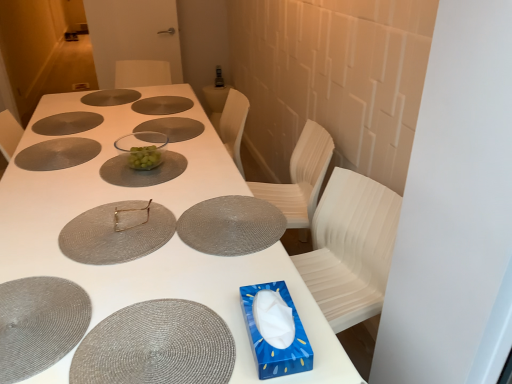
The width and height of the screenshot is (512, 384). What do you see at coordinates (39, 324) in the screenshot? I see `woven gray placemat at lower left` at bounding box center [39, 324].

I want to click on matte gray placemat at center, placed as the seventh glass plate when sorted from back to front, so click(x=231, y=225).

Find the location of a particular element. The height and width of the screenshot is (384, 512). matte gray glass plate at upper left, which is counted as the 7th glass plate, starting from the front is located at coordinates (67, 123).

Where is `matte gray glass plate at upper left, which is the 5th glass plate in back-to-front order`? The height and width of the screenshot is (384, 512). matte gray glass plate at upper left, which is the 5th glass plate in back-to-front order is located at coordinates (57, 154).

This screenshot has height=384, width=512. I want to click on transparent glass bowl at center, acting as the sixth glass plate starting from the back, so click(x=143, y=171).

In order to face transparent glass bowl at center, acting as the sixth glass plate starting from the back, should I rotate leftwards or rightwards?

To face it directly, rotate left by 14.122 degrees.

What are the coordinates of `woven gray placemat at lower left` in the screenshot? It's located at (39, 324).

Is there a large distance between matte gray glass plate at upper left, which is counted as the 7th glass plate, starting from the front, and woven gray placemat at lower left?

matte gray glass plate at upper left, which is counted as the 7th glass plate, starting from the front, is positioned a significant distance from woven gray placemat at lower left.

There is a woven gray placemat at lower left. Identify the location of glass plate above it (from a real-world perspective). (67, 123).

In the scene shown: How different are the orientations of matte gray glass plate at upper left, the third glass plate in the back-to-front sequence, and woven gray placemat at lower left in degrees?

matte gray glass plate at upper left, the third glass plate in the back-to-front sequence, and woven gray placemat at lower left are facing 0.347 degrees away from each other.

Can you confirm if matte gray glass plate at upper left, which is counted as the 7th glass plate, starting from the front, is bigger than woven gray placemat at lower left?

Correct, matte gray glass plate at upper left, which is counted as the 7th glass plate, starting from the front, is larger in size than woven gray placemat at lower left.

Where is `the 6th glass plate to the left of the blue paper tissue box at lower right, starting your count from the anchor`? Image resolution: width=512 pixels, height=384 pixels. the 6th glass plate to the left of the blue paper tissue box at lower right, starting your count from the anchor is located at coordinates (162, 105).

Looking at this image, from a real-world perspective, is blue paper tissue box at lower right on top of matte gray glass plate at center, which is the 2th glass plate in back-to-front order?

Indeed, from a real-world perspective, blue paper tissue box at lower right stands above matte gray glass plate at center, which is the 2th glass plate in back-to-front order.

Based on the photo, can you tell me how much blue paper tissue box at lower right and matte gray glass plate at center, which is the 2th glass plate in back-to-front order, differ in facing direction?

179 degrees separate the facing orientations of blue paper tissue box at lower right and matte gray glass plate at center, which is the 2th glass plate in back-to-front order.

Is blue paper tissue box at lower right behind matte gray glass plate at center, which is the 2th glass plate in back-to-front order?

No, it is in front of matte gray glass plate at center, which is the 2th glass plate in back-to-front order.

Are transparent glass bowl at center, acting as the sixth glass plate starting from the back, and matte gray placemat at center, arranged as the second glass plate when viewed from the front, far apart?

They are positioned close to each other.

Is transparent glass bowl at center, acting as the sixth glass plate starting from the back, facing towards matte gray placemat at center, arranged as the second glass plate when viewed from the front?

No, transparent glass bowl at center, acting as the sixth glass plate starting from the back, is not aimed at matte gray placemat at center, arranged as the second glass plate when viewed from the front.

Is transparent glass bowl at center, which is the fourth glass plate from front to back, taller or shorter than matte gray placemat at center, arranged as the second glass plate when viewed from the front?

Clearly, transparent glass bowl at center, which is the fourth glass plate from front to back, is taller compared to matte gray placemat at center, arranged as the second glass plate when viewed from the front.

From a real-world perspective, is transparent glass bowl at center, acting as the sixth glass plate starting from the back, located higher than matte gray placemat at center, arranged as the second glass plate when viewed from the front?

No, from a real-world perspective, transparent glass bowl at center, acting as the sixth glass plate starting from the back, is not on top of matte gray placemat at center, arranged as the second glass plate when viewed from the front.

Who is taller, matte silver fork at center or matte gray placemat at center, the 8th glass plate positioned from the back?

With more height is matte silver fork at center.

Where is `tableware above the matte gray placemat at center, arranged as the second glass plate when viewed from the front (from the image's perspective)`? Image resolution: width=512 pixels, height=384 pixels. tableware above the matte gray placemat at center, arranged as the second glass plate when viewed from the front (from the image's perspective) is located at coordinates (130, 211).

Is matte silver fork at center not near matte gray placemat at center, the 8th glass plate positioned from the back?

matte silver fork at center is actually quite close to matte gray placemat at center, the 8th glass plate positioned from the back.

Does matte silver fork at center have a smaller size compared to matte gray placemat at center, the 8th glass plate positioned from the back?

Correct, matte silver fork at center occupies less space than matte gray placemat at center, the 8th glass plate positioned from the back.

From the image's perspective, is matte gray placemat at center, the 8th glass plate positioned from the back, below transparent glass bowl at center, acting as the 6th glass plate starting from the front?

Indeed, from the image's perspective, matte gray placemat at center, the 8th glass plate positioned from the back, is shown beneath transparent glass bowl at center, acting as the 6th glass plate starting from the front.

Is the position of matte gray placemat at center, arranged as the second glass plate when viewed from the front, less distant than that of transparent glass bowl at center, acting as the 6th glass plate starting from the front?

Yes, the depth of matte gray placemat at center, arranged as the second glass plate when viewed from the front, is less than that of transparent glass bowl at center, acting as the 6th glass plate starting from the front.

Between point (101, 242) and point (173, 124), which one is positioned behind?

Positioned behind is point (173, 124).

Considering the relative positions of transparent glass bowl at center, acting as the sixth glass plate starting from the back, and matte gray placemat at center, placed as the third glass plate when sorted from front to back, in the image provided, is transparent glass bowl at center, acting as the sixth glass plate starting from the back, to the right of matte gray placemat at center, placed as the third glass plate when sorted from front to back, from the viewer's perspective?

In fact, transparent glass bowl at center, acting as the sixth glass plate starting from the back, is to the left of matte gray placemat at center, placed as the third glass plate when sorted from front to back.

From a real-world perspective, who is located lower, transparent glass bowl at center, which is the fourth glass plate from front to back, or matte gray placemat at center, placed as the seventh glass plate when sorted from back to front?

In real-world perspective, matte gray placemat at center, placed as the seventh glass plate when sorted from back to front, is lower.

Is transparent glass bowl at center, acting as the sixth glass plate starting from the back, positioned beyond the bounds of matte gray placemat at center, placed as the third glass plate when sorted from front to back?

Absolutely, transparent glass bowl at center, acting as the sixth glass plate starting from the back, is external to matte gray placemat at center, placed as the third glass plate when sorted from front to back.

Is matte gray placemat at center, the 8th glass plate positioned from the back, facing away from matte gray glass plate at center, the eighth glass plate viewed from the front?

No, matte gray glass plate at center, the eighth glass plate viewed from the front, is not at the back of matte gray placemat at center, the 8th glass plate positioned from the back.

From the image's perspective, which one is positioned higher, matte gray placemat at center, arranged as the second glass plate when viewed from the front, or matte gray glass plate at center, the eighth glass plate viewed from the front?

matte gray glass plate at center, the eighth glass plate viewed from the front.

Locate an element on the screen. The width and height of the screenshot is (512, 384). the 6th glass plate below when counting from the matte gray glass plate at center, which is the 2th glass plate in back-to-front order (from the image's perspective) is located at coordinates (117, 232).

Does matte gray placemat at center, arranged as the second glass plate when viewed from the front, lie in front of matte gray glass plate at center, the eighth glass plate viewed from the front?

Yes, it is.

In the image, there is a matte gray glass plate at upper left, the third glass plate in the back-to-front sequence. At what (x,y) coordinates should I click in order to perform the action: click on plate below it (from a real-world perspective). Please return your answer as a coordinate pair (x, y). Looking at the image, I should click on (39, 324).

From the image's perspective, count 7th glass plates upward from the blue paper tissue box at lower right and point to it. Please provide its 2D coordinates.

[(162, 105)]

Estimate the real-world distances between objects in this image. Which object is closer to matte silver fork at center, woven gray placemat at lower left or transparent glass bowl at center, which is the fourth glass plate from front to back?

transparent glass bowl at center, which is the fourth glass plate from front to back, lies closer to matte silver fork at center than the other object.

Looking at the image, which one is located further to matte gray placemat at center, the 8th glass plate positioned from the back, matte gray placemat at lower center, the first glass plate in the front-to-back sequence, or blue paper tissue box at lower right?

The object further to matte gray placemat at center, the 8th glass plate positioned from the back, is blue paper tissue box at lower right.

Based on their spatial positions, is white matte table at center or transparent glass bowl at center, the fourth glass plate viewed from the back, closer to matte gray placemat at center, placed as the third glass plate when sorted from front to back?

The object closer to matte gray placemat at center, placed as the third glass plate when sorted from front to back, is white matte table at center.

Estimate the real-world distances between objects in this image. Which object is closer to white matte table at center, matte silver fork at center or woven gray placemat at lower left?

The object closer to white matte table at center is woven gray placemat at lower left.

Based on the photo, looking at the image, which one is located further to blue paper tissue box at lower right, matte gray glass plate at upper left, which is counted as the 7th glass plate, starting from the front, or woven gray placemat at lower left?

matte gray glass plate at upper left, which is counted as the 7th glass plate, starting from the front.

When comparing their distances from transparent glass bowl at center, does matte gray glass plate at upper left, the third glass plate in the back-to-front sequence, or matte gray glass plate at upper left, the fifth glass plate when ordered from front to back, seem further?

matte gray glass plate at upper left, the third glass plate in the back-to-front sequence, lies further to transparent glass bowl at center than the other object.

From the image, which object appears to be farther from matte gray glass plate at center, which is the 2th glass plate in back-to-front order, matte silver fork at center or matte gray placemat at lower center, the first glass plate in the front-to-back sequence?

matte gray placemat at lower center, the first glass plate in the front-to-back sequence, lies further to matte gray glass plate at center, which is the 2th glass plate in back-to-front order, than the other object.

Considering their positions, is matte gray glass plate at upper center, which is the 9th glass plate from front to back, positioned further to white matte table at center than matte gray glass plate at upper left, which is the 5th glass plate in back-to-front order?

Among the two, matte gray glass plate at upper center, which is the 9th glass plate from front to back, is located further to white matte table at center.

This screenshot has width=512, height=384. Identify the location of plate located between matte gray placemat at lower center, the first glass plate in the front-to-back sequence, and matte gray glass plate at upper center, which ranks as the 1th glass plate in back-to-front order, in the depth direction. (39, 324).

Where is `tableware positioned between matte gray placemat at lower center, the ninth glass plate from the back, and matte gray glass plate at upper center, which ranks as the 1th glass plate in back-to-front order, from near to far`? tableware positioned between matte gray placemat at lower center, the ninth glass plate from the back, and matte gray glass plate at upper center, which ranks as the 1th glass plate in back-to-front order, from near to far is located at coordinates (130, 211).

At what (x,y) coordinates should I click in order to perform the action: click on tableware between woven gray placemat at lower left and matte gray glass plate at center, which is the 2th glass plate in back-to-front order, along the z-axis. Please return your answer as a coordinate pair (x, y). This screenshot has height=384, width=512. Looking at the image, I should click on (130, 211).

Identify the location of box located between woven gray placemat at lower left and transparent glass bowl at center in the depth direction. (270, 345).